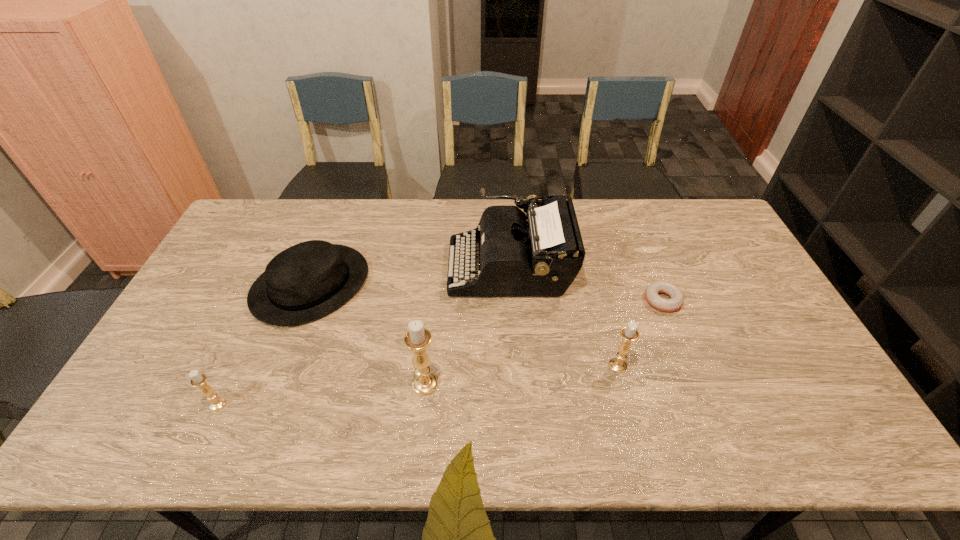
Where is `the nearest object`? Image resolution: width=960 pixels, height=540 pixels. the nearest object is located at coordinates (198, 379).

Image resolution: width=960 pixels, height=540 pixels. I want to click on the shortest candle holder, so click(198, 379).

Where is `the second candle holder from left to right`? This screenshot has width=960, height=540. the second candle holder from left to right is located at coordinates (417, 339).

Locate an element on the screen. This screenshot has width=960, height=540. the third object from left to right is located at coordinates (417, 339).

The width and height of the screenshot is (960, 540). In order to click on the rightmost candle holder in this screenshot , I will do `click(629, 333)`.

This screenshot has height=540, width=960. I want to click on the second object from right to left, so click(x=629, y=333).

Identify the location of fedora. The image size is (960, 540). (308, 280).

Where is `the rightmost object`? Image resolution: width=960 pixels, height=540 pixels. the rightmost object is located at coordinates (651, 293).

This screenshot has height=540, width=960. I want to click on doughnut, so click(651, 293).

The image size is (960, 540). Identify the location of the fourth object from left to right. (540, 253).